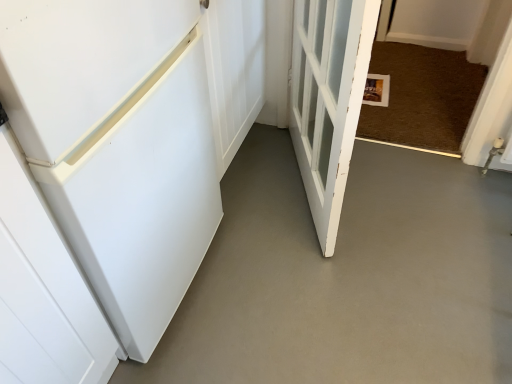
What do you see at coordinates (328, 99) in the screenshot? Image resolution: width=512 pixels, height=384 pixels. I see `white wooden door at center, the second door from the left` at bounding box center [328, 99].

Find the location of a particular element. The image size is (512, 384). white smooth concrete at lower left is located at coordinates (347, 277).

Describe the element at coordinates (347, 277) in the screenshot. This screenshot has width=512, height=384. I see `white smooth concrete at lower left` at that location.

This screenshot has height=384, width=512. Find the location of `white matte refrigerator at left, which ranks as the first door in left-to-right order`. white matte refrigerator at left, which ranks as the first door in left-to-right order is located at coordinates (118, 145).

Where is `the 1st door above the white smooth concrete at lower left (from the image's perspective)`? the 1st door above the white smooth concrete at lower left (from the image's perspective) is located at coordinates (328, 99).

Considering the sizes of white smooth concrete at lower left and white wooden door at center, the second door from the left, in the image, is white smooth concrete at lower left taller or shorter than white wooden door at center, the second door from the left,?

white smooth concrete at lower left is shorter than white wooden door at center, the second door from the left.

Is white smooth concrete at lower left far away from white wooden door at center, the second door from the left?

They are positioned close to each other.

Considering the relative sizes of white smooth concrete at lower left and white wooden door at center, which appears as the first door when viewed from the right, in the image provided, is white smooth concrete at lower left smaller than white wooden door at center, which appears as the first door when viewed from the right,?

Indeed, white smooth concrete at lower left has a smaller size compared to white wooden door at center, which appears as the first door when viewed from the right.

Who is taller, white matte refrigerator at left, the 2th door viewed from the right, or white smooth concrete at lower left?

With more height is white matte refrigerator at left, the 2th door viewed from the right.

Looking at this image, from a real-world perspective, does white matte refrigerator at left, the 2th door viewed from the right, sit lower than white smooth concrete at lower left?

No, from a real-world perspective, white matte refrigerator at left, the 2th door viewed from the right, is not beneath white smooth concrete at lower left.

Can you confirm if white matte refrigerator at left, which ranks as the first door in left-to-right order, is positioned to the right of white smooth concrete at lower left?

Incorrect, white matte refrigerator at left, which ranks as the first door in left-to-right order, is not on the right side of white smooth concrete at lower left.

From the image's perspective, is white matte refrigerator at left, the 2th door viewed from the right, positioned above or below white smooth concrete at lower left?

From the image's perspective, white matte refrigerator at left, the 2th door viewed from the right, appears above white smooth concrete at lower left.

From a real-world perspective, is white matte refrigerator at left, which ranks as the first door in left-to-right order, on top of white wooden door at center, which appears as the first door when viewed from the right?

Actually, white matte refrigerator at left, which ranks as the first door in left-to-right order, is physically below white wooden door at center, which appears as the first door when viewed from the right, in the real world.

This screenshot has height=384, width=512. Find the location of `door that is above the white wooden door at center, the second door from the left (from the image's perspective)`. door that is above the white wooden door at center, the second door from the left (from the image's perspective) is located at coordinates (118, 145).

Based on the photo, considering the sizes of objects white matte refrigerator at left, the 2th door viewed from the right, and white wooden door at center, which appears as the first door when viewed from the right, in the image provided, who is wider, white matte refrigerator at left, the 2th door viewed from the right, or white wooden door at center, which appears as the first door when viewed from the right,?

Wider between the two is white matte refrigerator at left, the 2th door viewed from the right.

From the image's perspective, which object appears higher, white matte refrigerator at left, the 2th door viewed from the right, or white wooden door at center, the second door from the left?

white matte refrigerator at left, the 2th door viewed from the right.

From their relative heights in the image, would you say white wooden door at center, the second door from the left, is taller or shorter than white matte refrigerator at left, which ranks as the first door in left-to-right order?

Considering their sizes, white wooden door at center, the second door from the left, has more height than white matte refrigerator at left, which ranks as the first door in left-to-right order.

From the image's perspective, is white wooden door at center, the second door from the left, located above or below white matte refrigerator at left, which ranks as the first door in left-to-right order?

From the image's perspective, white wooden door at center, the second door from the left, appears below white matte refrigerator at left, which ranks as the first door in left-to-right order.

From a real-world perspective, is white wooden door at center, the second door from the left, beneath white matte refrigerator at left, which ranks as the first door in left-to-right order?

No, from a real-world perspective, white wooden door at center, the second door from the left, is not under white matte refrigerator at left, which ranks as the first door in left-to-right order.

Based on the photo, between white smooth concrete at lower left and white matte refrigerator at left, which ranks as the first door in left-to-right order, which one appears on the right side from the viewer's perspective?

From the viewer's perspective, white smooth concrete at lower left appears more on the right side.

Is white smooth concrete at lower left in front of white matte refrigerator at left, the 2th door viewed from the right?

Yes, the depth of white smooth concrete at lower left is less than that of white matte refrigerator at left, the 2th door viewed from the right.

From the image's perspective, is white smooth concrete at lower left below white matte refrigerator at left, the 2th door viewed from the right?

Yes.

There is a white smooth concrete at lower left. In order to click on the 2nd door above it (from the image's perspective) in this screenshot , I will do `click(118, 145)`.

Is white wooden door at center, the second door from the left, wider or thinner than white smooth concrete at lower left?

white wooden door at center, the second door from the left, is thinner than white smooth concrete at lower left.

Is white wooden door at center, the second door from the left, in contact with white smooth concrete at lower left?

They are not placed beside each other.

From a real-world perspective, which object rests below the other?

white smooth concrete at lower left, from a real-world perspective.

Is white wooden door at center, which appears as the first door when viewed from the right, positioned behind white smooth concrete at lower left?

No, white wooden door at center, which appears as the first door when viewed from the right, is closer to the viewer.

The image size is (512, 384). I want to click on concrete that is behind the white wooden door at center, which appears as the first door when viewed from the right, so point(347,277).

Where is `concrete in front of the white matte refrigerator at left, the 2th door viewed from the right`? The image size is (512, 384). concrete in front of the white matte refrigerator at left, the 2th door viewed from the right is located at coordinates (347, 277).

Considering their positions, is white smooth concrete at lower left positioned closer to white wooden door at center, the second door from the left, than white matte refrigerator at left, the 2th door viewed from the right?

white smooth concrete at lower left.

Looking at the image, which one is located closer to white smooth concrete at lower left, white matte refrigerator at left, the 2th door viewed from the right, or white wooden door at center, the second door from the left?

Based on the image, white wooden door at center, the second door from the left, appears to be nearer to white smooth concrete at lower left.

Considering their positions, is white wooden door at center, the second door from the left, positioned further to white matte refrigerator at left, the 2th door viewed from the right, than white smooth concrete at lower left?

white smooth concrete at lower left.

When comparing their distances from white wooden door at center, the second door from the left, does white matte refrigerator at left, which ranks as the first door in left-to-right order, or white smooth concrete at lower left seem further?

The object further to white wooden door at center, the second door from the left, is white matte refrigerator at left, which ranks as the first door in left-to-right order.

Looking at this image, which object lies nearer to the anchor point white matte refrigerator at left, which ranks as the first door in left-to-right order, white smooth concrete at lower left or white wooden door at center, which appears as the first door when viewed from the right?

white wooden door at center, which appears as the first door when viewed from the right, is closer to white matte refrigerator at left, which ranks as the first door in left-to-right order.

Based on their spatial positions, is white wooden door at center, which appears as the first door when viewed from the right, or white matte refrigerator at left, which ranks as the first door in left-to-right order, closer to white smooth concrete at lower left?

white wooden door at center, which appears as the first door when viewed from the right, is positioned closer to the anchor white smooth concrete at lower left.

Find the location of `door between white matte refrigerator at left, which ranks as the first door in left-to-right order, and white smooth concrete at lower left vertically`. door between white matte refrigerator at left, which ranks as the first door in left-to-right order, and white smooth concrete at lower left vertically is located at coordinates (328, 99).